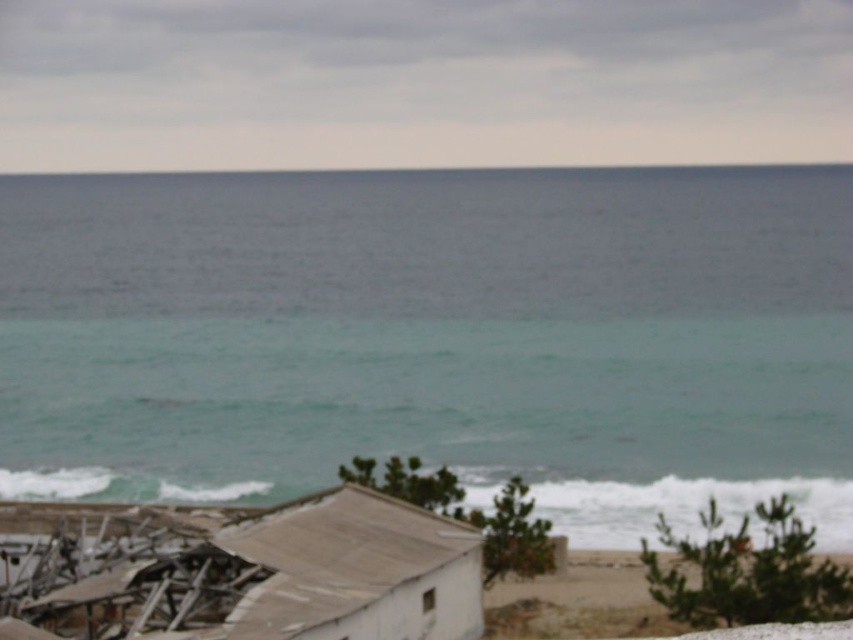
You are a photographer planning to capture the entire scene in one shot. Given that the white corrugated metal hut at lower left is narrower than the teal water at center, which object would you need to frame more carefully to ensure it fits within the camera view?

The white corrugated metal hut at lower left is narrower than the teal water at center, so you should frame the white corrugated metal hut at lower left more carefully to ensure it fits within the camera view.

You are standing on the beach and want to take a photo of both the teal water at center and the white corrugated metal hut at lower left. Since the camera can only focus on one subject at a time, which one should you choose to ensure it fills more of the frame?

The teal water at center has a larger size compared to the white corrugated metal hut at lower left, so you should choose the teal water at center to fill more of the frame.